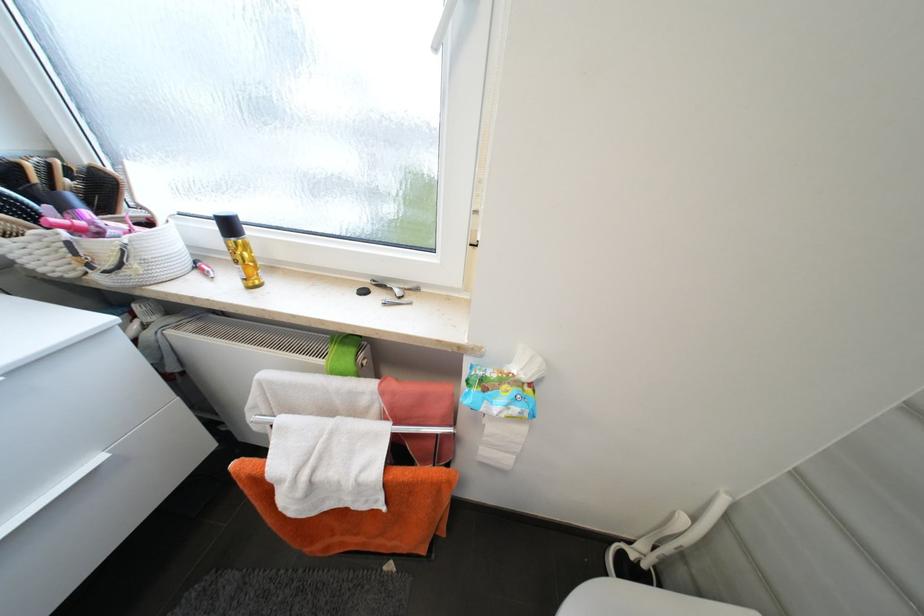
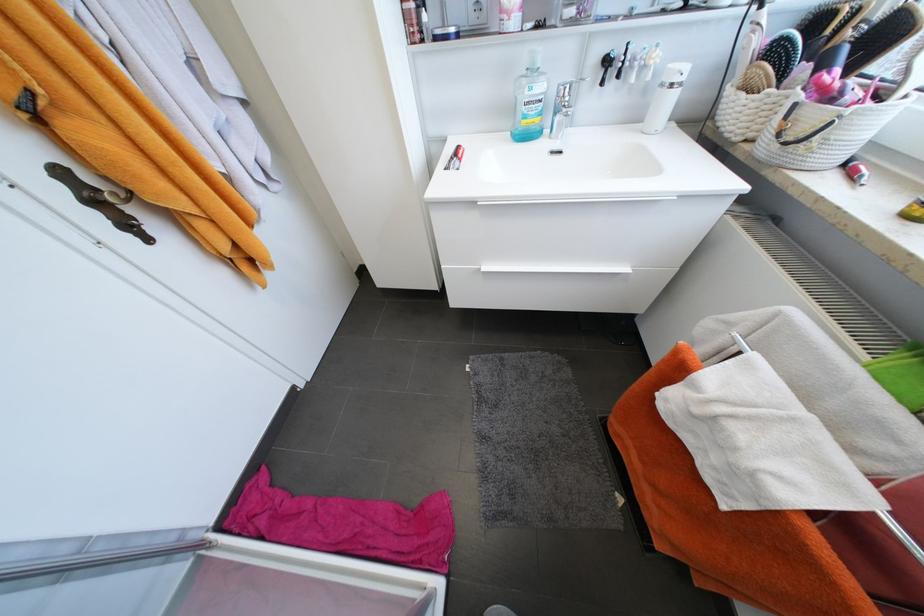
Where in the second image is the point corresponding to point (69, 209) from the first image?

(829, 66)